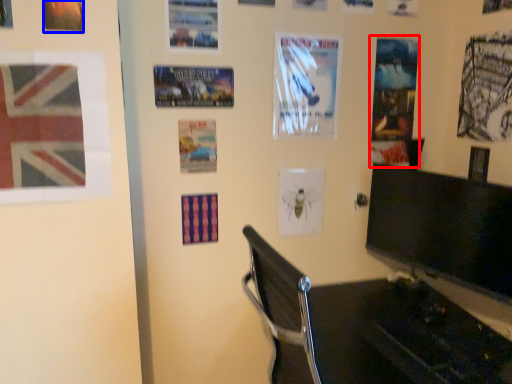
Question: Which point is further to the camera, poster page (highlighted by a red box) or poster page (highlighted by a blue box)?

Choices:
 (A) poster page
 (B) poster page

Answer: (A)